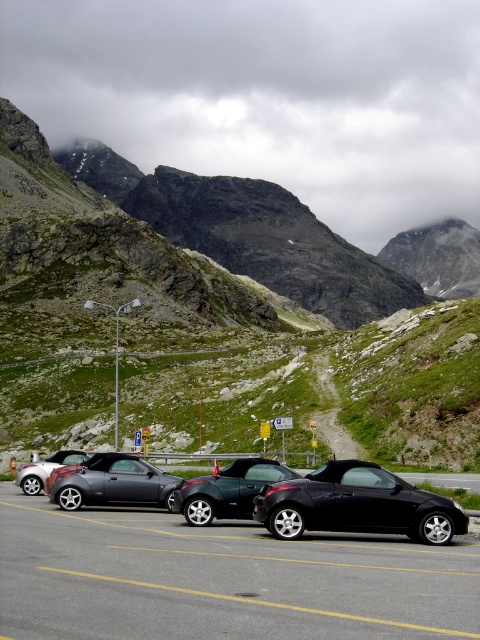
Who is positioned more to the left, metallic gray car at center or black matte convertible at center?

From the viewer's perspective, metallic gray car at center appears more on the left side.

Can you confirm if metallic gray car at center is shorter than black matte convertible at center?

No.

Is point (409, 374) behind point (308, 493)?

That is True.

The width and height of the screenshot is (480, 640). Identify the location of metallic gray car at center. (202, 323).

Does rugged granite mountain at upper center have a smaller size compared to metallic gray convertible at center?

Incorrect, rugged granite mountain at upper center is not smaller in size than metallic gray convertible at center.

Between rugged granite mountain at upper center and metallic gray convertible at center, which one has less height?

With less height is metallic gray convertible at center.

Between point (428, 259) and point (96, 474), which one is positioned behind?

Positioned behind is point (428, 259).

You are a GUI agent. You are given a task and a screenshot of the screen. Output one action in this format:
    pyautogui.click(x=<x>, y=<y>)
    Task: Click on the rugged granite mountain at upper center
    Image resolution: width=480 pixels, height=640 pixels.
    Given the screenshot: What is the action you would take?
    pyautogui.click(x=439, y=257)

Who is lower down, rugged granite mountain at upper center or metallic silver convertible at center?

metallic silver convertible at center is lower down.

Is rugged granite mountain at upper center above metallic silver convertible at center?

Indeed, rugged granite mountain at upper center is positioned over metallic silver convertible at center.

Which is in front, point (415, 275) or point (33, 461)?

Point (33, 461) is more forward.

What are the coordinates of `rugged granite mountain at upper center` in the screenshot? It's located at (439, 257).